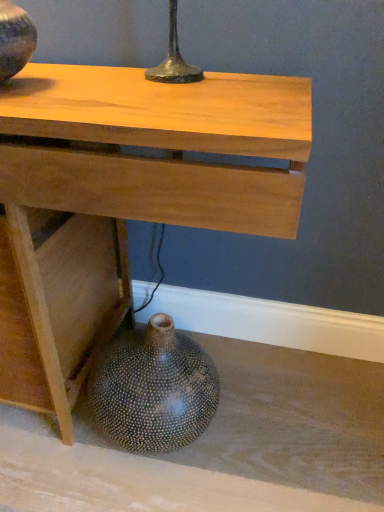
The height and width of the screenshot is (512, 384). Find the location of `empty space that is ontop of natural wood table at center (from a real-world perspective)`. empty space that is ontop of natural wood table at center (from a real-world perspective) is located at coordinates [x=119, y=93].